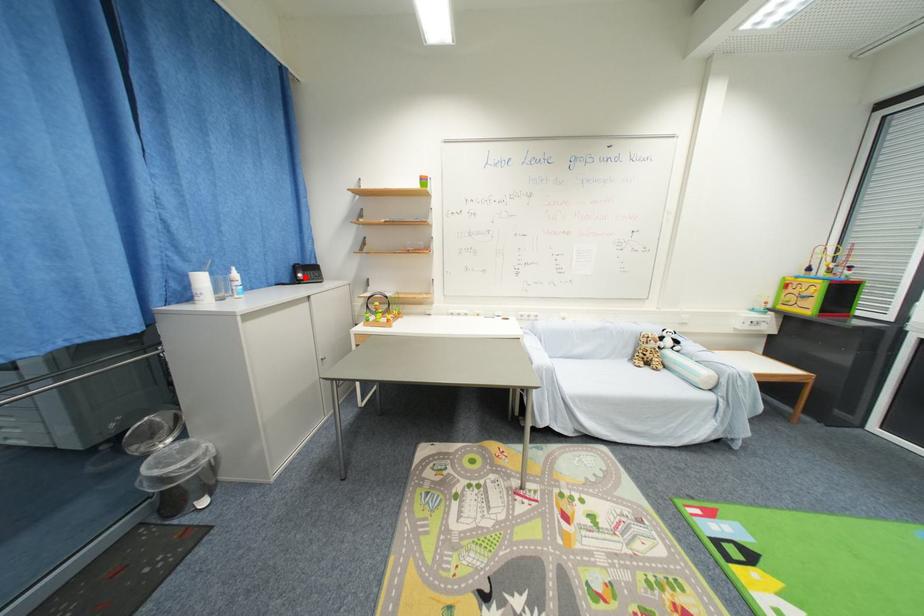
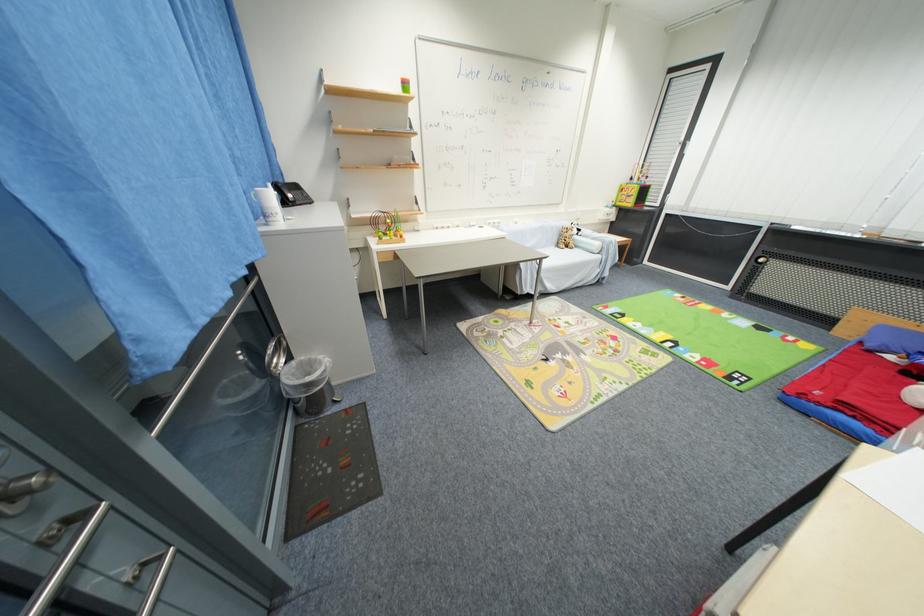
In the second image, find the point that corresponds to the highlighted location in the first image.

(296, 198)